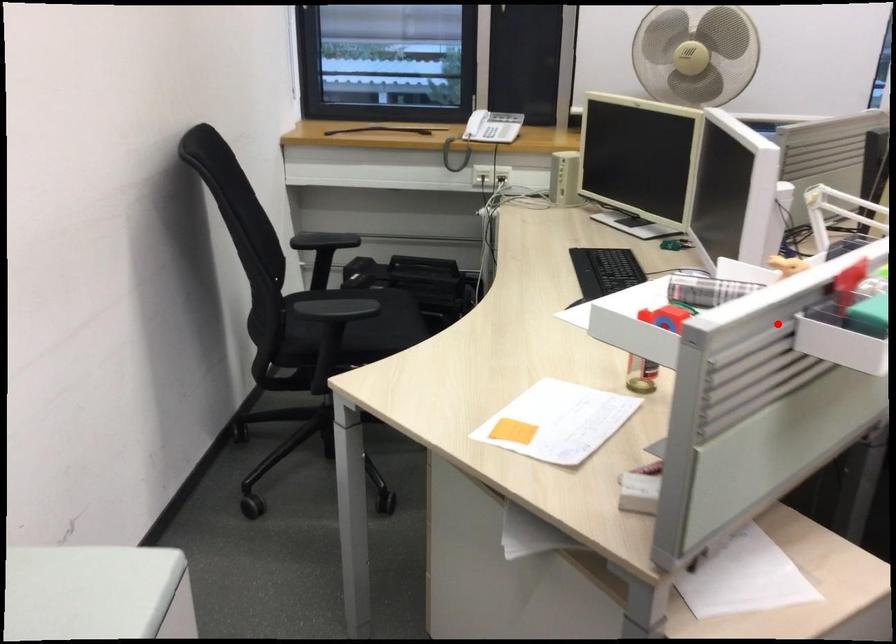
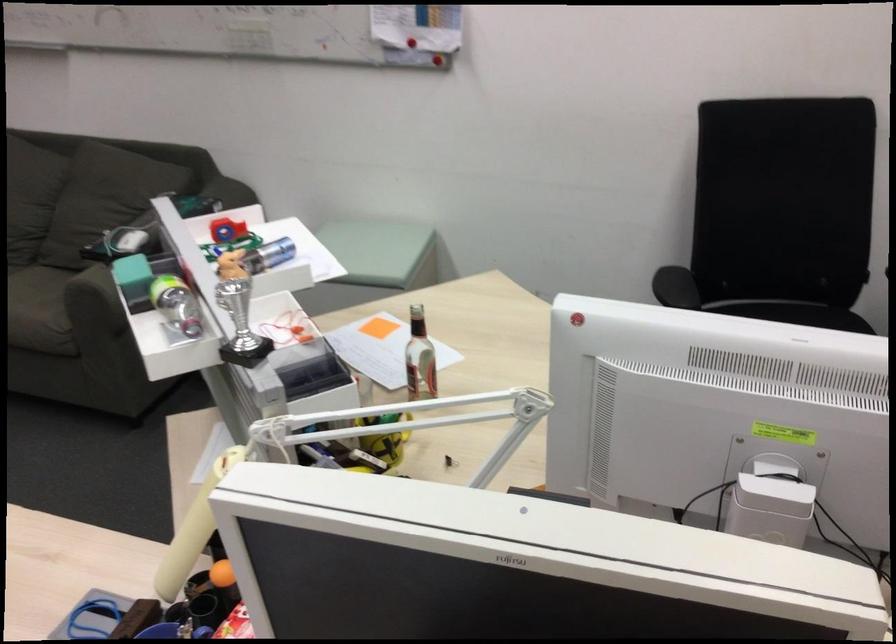
Question: I am providing you with two images of the same scene from different viewpoints. A red point is shown in image1. For the corresponding object point in image2, is it positioned nearer or farther from the camera?

Choices:
 (A) Nearer
 (B) Farther

Answer: (B)